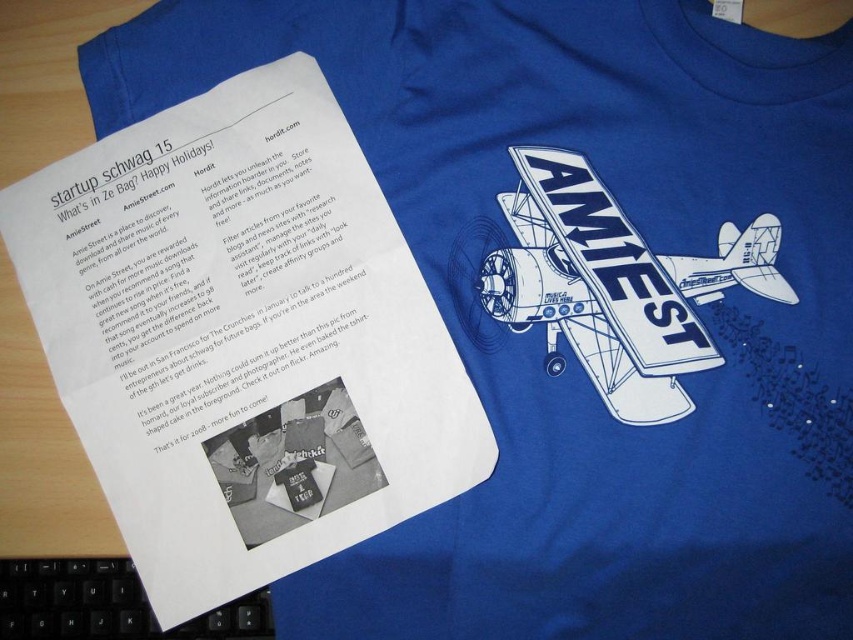
Between white matte airplane at center and black plastic keyboard at lower left, which one is positioned higher?

white matte airplane at center is above.

Is point (572, 264) behind point (233, 634)?

No, it is not.

Who is more forward, (515, 209) or (3, 600)?

Point (515, 209) is more forward.

Where is `white matte airplane at center`? This screenshot has height=640, width=853. white matte airplane at center is located at coordinates (614, 285).